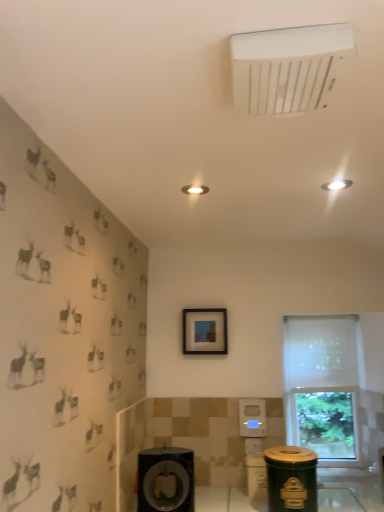
This screenshot has width=384, height=512. What are the coordinates of `matte black speaker at lower center` in the screenshot? It's located at (165, 480).

Locate an element on the screen. The height and width of the screenshot is (512, 384). matte black picture frame at center is located at coordinates (204, 331).

This screenshot has height=512, width=384. Identify the location of white frosted glass window at right. [x=322, y=387].

You are a GUI agent. You are given a task and a screenshot of the screen. Output one action in this format:
    pyautogui.click(x=<x>, y=<y>)
    Task: Click on the white plastic air conditioning unit at upper center
    
    Given the screenshot: What is the action you would take?
    pos(287,67)

Who is more distant, matte black picture frame at center or white frosted glass window at right?

white frosted glass window at right is further from the camera.

Measure the distance from matte black picture frame at center to white frosted glass window at right.

The distance of matte black picture frame at center from white frosted glass window at right is 27.53 inches.

Can we say matte black picture frame at center lies outside white frosted glass window at right?

Yes, matte black picture frame at center is located beyond the bounds of white frosted glass window at right.

Which is behind, point (208, 335) or point (339, 343)?

Point (339, 343)

Is white plastic air conditioning unit at upper center touching white frosted glass window at right?

white plastic air conditioning unit at upper center and white frosted glass window at right are clearly separated.

How distant is white plastic air conditioning unit at upper center from white frosted glass window at right?

white plastic air conditioning unit at upper center is 6.90 feet from white frosted glass window at right.

Which is more to the left, white plastic air conditioning unit at upper center or white frosted glass window at right?

white plastic air conditioning unit at upper center is more to the left.

From their relative heights in the image, would you say white plastic air conditioning unit at upper center is taller or shorter than white frosted glass window at right?

white plastic air conditioning unit at upper center is shorter than white frosted glass window at right.

Would you say white frosted glass window at right is a long distance from matte black picture frame at center?

No, white frosted glass window at right is not far from matte black picture frame at center.

In the scene shown: Does white frosted glass window at right have a greater height compared to matte black picture frame at center?

Correct, white frosted glass window at right is much taller as matte black picture frame at center.

From a real-world perspective, who is located lower, white frosted glass window at right or matte black picture frame at center?

In real-world perspective, white frosted glass window at right is lower.

Considering the relative positions of white frosted glass window at right and matte black speaker at lower center in the image provided, is white frosted glass window at right in front of matte black speaker at lower center?

That is False.

Is white frosted glass window at right touching matte black speaker at lower center?

white frosted glass window at right and matte black speaker at lower center are not in contact.

Can you confirm if white frosted glass window at right is shorter than matte black speaker at lower center?

No, white frosted glass window at right is not shorter than matte black speaker at lower center.

Based on the photo, is white frosted glass window at right positioned with its back to matte black speaker at lower center?

No, white frosted glass window at right is not facing away from matte black speaker at lower center.

Is white plastic air conditioning unit at upper center far from matte black picture frame at center?

Yes, white plastic air conditioning unit at upper center and matte black picture frame at center are quite far apart.

Is white plastic air conditioning unit at upper center located outside matte black picture frame at center?

white plastic air conditioning unit at upper center lies outside matte black picture frame at center's area.

How far apart are white plastic air conditioning unit at upper center and matte black picture frame at center?

white plastic air conditioning unit at upper center and matte black picture frame at center are 5.67 feet apart.

Looking at this image, does white plastic air conditioning unit at upper center appear on the right side of matte black picture frame at center?

Yes, white plastic air conditioning unit at upper center is to the right of matte black picture frame at center.

Would you say matte black speaker at lower center is part of white plastic air conditioning unit at upper center's contents?

Definitely not — matte black speaker at lower center is not inside white plastic air conditioning unit at upper center.

Considering the relative sizes of white plastic air conditioning unit at upper center and matte black speaker at lower center in the image provided, is white plastic air conditioning unit at upper center shorter than matte black speaker at lower center?

Yes, white plastic air conditioning unit at upper center is shorter than matte black speaker at lower center.

Where is `speaker below the white plastic air conditioning unit at upper center (from a real-world perspective)`? speaker below the white plastic air conditioning unit at upper center (from a real-world perspective) is located at coordinates (165, 480).

Is point (280, 52) positioned in front of point (175, 448)?

Yes.

At what (x,y) coordinates should I click in order to perform the action: click on curtain to the right of matte black picture frame at center. Please return your answer as a coordinate pair (x, y). This screenshot has height=512, width=384. Looking at the image, I should click on (319, 351).

Is white sheer curtain at right next to matte black picture frame at center and touching it?

No, white sheer curtain at right is not next to matte black picture frame at center.

Which is more to the right, white sheer curtain at right or matte black picture frame at center?

white sheer curtain at right is more to the right.

From a real-world perspective, is white sheer curtain at right located beneath matte black picture frame at center?

Correct, in the physical world, white sheer curtain at right is lower than matte black picture frame at center.

There is a white frosted glass window at right. At what (x,y) coordinates should I click in order to perform the action: click on picture frame above it (from a real-world perspective). Please return your answer as a coordinate pair (x, y). The height and width of the screenshot is (512, 384). Looking at the image, I should click on (204, 331).

The width and height of the screenshot is (384, 512). In order to click on window that is on the right side of white plastic air conditioning unit at upper center in this screenshot , I will do `click(322, 387)`.

Based on their spatial positions, is matte black picture frame at center or green matte trash can at lower right further from white sheer curtain at right?

Among the two, green matte trash can at lower right is located further to white sheer curtain at right.

Estimate the real-world distances between objects in this image. Which object is further from matte black picture frame at center, white plastic air conditioning unit at upper center or white sheer curtain at right?

white plastic air conditioning unit at upper center is further to matte black picture frame at center.

Estimate the real-world distances between objects in this image. Which object is further from white frosted glass window at right, green matte trash can at lower right or white plastic air conditioning unit at upper center?

white plastic air conditioning unit at upper center lies further to white frosted glass window at right than the other object.

Considering their positions, is green matte trash can at lower right positioned further to white sheer curtain at right than matte black picture frame at center?

The object further to white sheer curtain at right is green matte trash can at lower right.

Which object lies further to the anchor point white frosted glass window at right, white plastic air conditioning unit at upper center or matte black speaker at lower center?

Among the two, white plastic air conditioning unit at upper center is located further to white frosted glass window at right.

From the image, which object appears to be farther from white sheer curtain at right, white plastic air conditioning unit at upper center or white frosted glass window at right?

white plastic air conditioning unit at upper center lies further to white sheer curtain at right than the other object.

Considering their positions, is white plastic air conditioning unit at upper center positioned further to matte black speaker at lower center than white sheer curtain at right?

white plastic air conditioning unit at upper center is positioned further to the anchor matte black speaker at lower center.

Which object lies nearer to the anchor point matte black speaker at lower center, white plastic air conditioning unit at upper center or green matte trash can at lower right?

The object closer to matte black speaker at lower center is green matte trash can at lower right.

This screenshot has width=384, height=512. Find the location of `window between green matte trash can at lower right and white sheer curtain at right from front to back`. window between green matte trash can at lower right and white sheer curtain at right from front to back is located at coordinates (322, 387).

The width and height of the screenshot is (384, 512). In order to click on garbage between matte black speaker at lower center and matte black picture frame at center in the front-back direction in this screenshot , I will do `click(291, 479)`.

This screenshot has height=512, width=384. Find the location of `picture frame between matte black speaker at lower center and white frosted glass window at right in the horizontal direction`. picture frame between matte black speaker at lower center and white frosted glass window at right in the horizontal direction is located at coordinates (204, 331).

Find the location of a particular element. picture frame between green matte trash can at lower right and white frosted glass window at right from front to back is located at coordinates (204, 331).